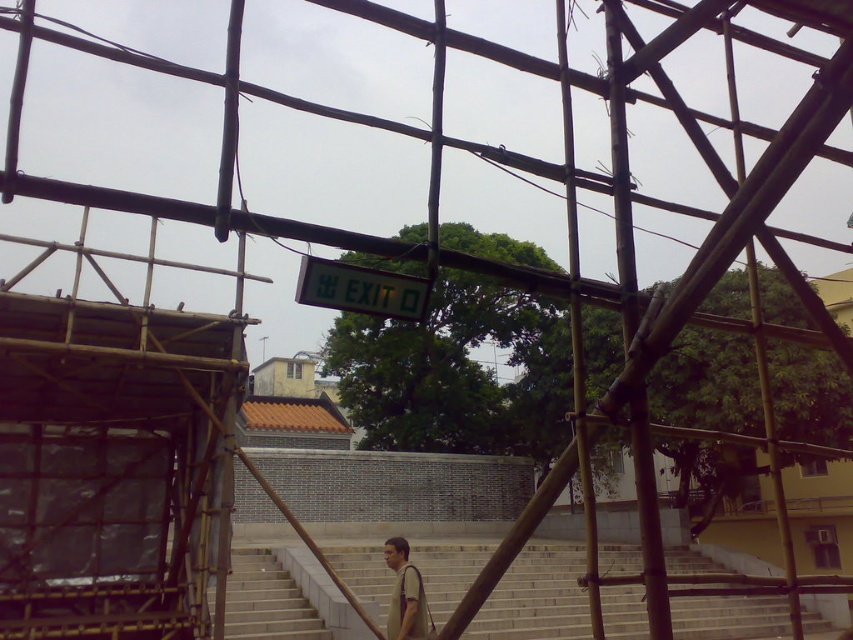
You are a construction worker standing at the base of the light gray concrete stairs at center. You need to deliver a tool to a colleague wearing a light brown fabric shirt at center who is walking up the stairs. The tool weighs 5 kilograms and requires careful handling. Considering the distance between you and your colleague, what is the safest method to hand over the tool without endangering either of you?

The light gray concrete stairs at center is 10.82 meters away from the light brown fabric shirt at center. The safest method would be to wait until the colleague reaches the bottom of the stairs or to use a nonhazardous method like placing the tool on a stable surface near the stairs and signaling them to retrieve it safely.

You are standing on the light gray concrete stairs at center and want to hand a tool to the person wearing the light brown fabric shirt at center. Which direction should you move to reach them?

The light gray concrete stairs at center is on the right side of the light brown fabric shirt at center, so you should move to your left to reach the person wearing the light brown fabric shirt at center.